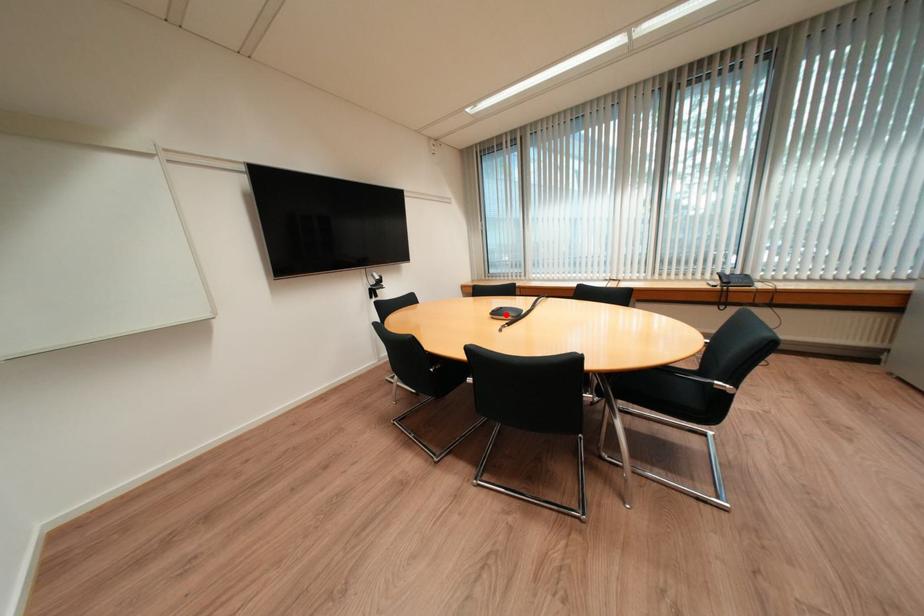
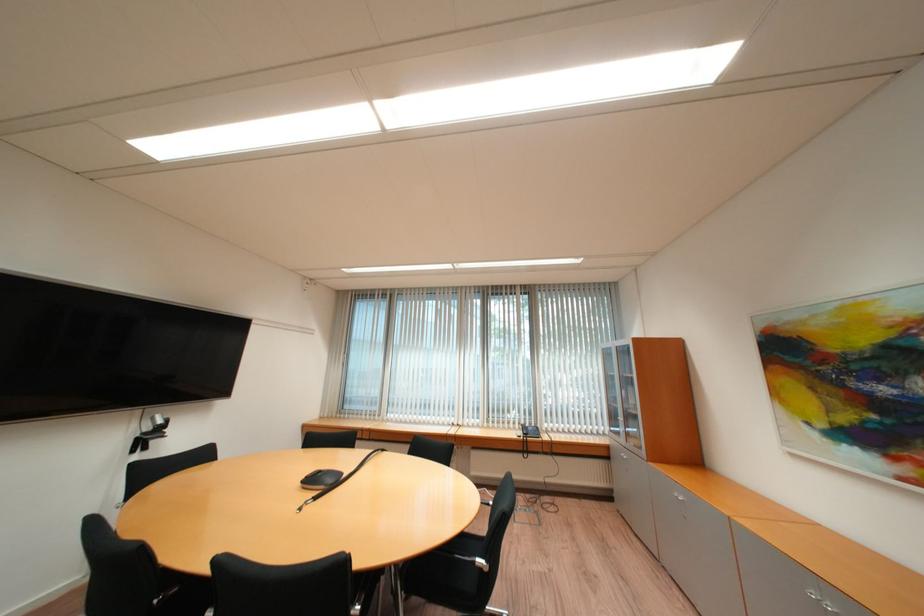
Find the pixel in the second image that matches the highlighted location in the first image.

(320, 482)